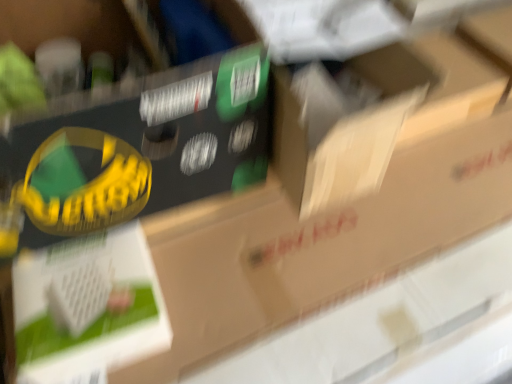
Where is `cardboard box at center`? cardboard box at center is located at coordinates (343, 124).

What is the approximate width of cardboard box at center?

8.60 inches.

What do you see at coordinates (343, 124) in the screenshot?
I see `cardboard box at center` at bounding box center [343, 124].

The width and height of the screenshot is (512, 384). What do you see at coordinates (136, 147) in the screenshot? I see `cardboard box at center` at bounding box center [136, 147].

Consider the image. In order to face cardboard box at center, should I rotate leftwards or rightwards?

A 11.428 degree turn to the left will do.

In order to click on cardboard box at center in this screenshot , I will do `click(136, 147)`.

Where is `cardboard box at center`? Image resolution: width=512 pixels, height=384 pixels. cardboard box at center is located at coordinates (343, 124).

Which object is positioned more to the right, cardboard box at center or cardboard box at center?

cardboard box at center is more to the right.

Considering their positions, is cardboard box at center located in front of or behind cardboard box at center?

Visually, cardboard box at center is located in front of cardboard box at center.

Which point is more forward, (228, 109) or (343, 187)?

The point (228, 109) is closer to the camera.

From the image's perspective, does cardboard box at center appear higher than cardboard box at center?

Indeed, from the image's perspective, cardboard box at center is shown above cardboard box at center.

From a real-world perspective, which object rests below the other?

From a 3D spatial view, cardboard box at center is below.

Looking at their sizes, would you say cardboard box at center is wider or thinner than cardboard box at center?

Clearly, cardboard box at center has more width compared to cardboard box at center.

Who is taller, cardboard box at center or cardboard box at center?

cardboard box at center is taller.

Which of these two, cardboard box at center or cardboard box at center, is bigger?

cardboard box at center.

Is cardboard box at center surrounded by cardboard box at center?

No, cardboard box at center does not contain cardboard box at center.

Is cardboard box at center positioned far away from cardboard box at center?

That's not correct — cardboard box at center is a little close to cardboard box at center.

Could you tell me if cardboard box at center is turned towards cardboard box at center?

Yes, cardboard box at center is aimed at cardboard box at center.

How many degrees apart are the facing directions of cardboard box at center and cardboard box at center?

cardboard box at center and cardboard box at center are facing 0.374 degrees away from each other.

Find the location of `cardboard box that appears behind the cardboard box at center`. cardboard box that appears behind the cardboard box at center is located at coordinates (343, 124).

Which object is positioned more to the left, cardboard box at center or cardboard box at center?

From the viewer's perspective, cardboard box at center appears more on the left side.

In the image, is cardboard box at center positioned in front of or behind cardboard box at center?

cardboard box at center is behind cardboard box at center.

Between point (314, 167) and point (148, 106), which one is positioned behind?

The point (314, 167) is more distant.

From the image's perspective, is cardboard box at center positioned above or below cardboard box at center?

cardboard box at center is situated lower than cardboard box at center in the image.

From a real-world perspective, does cardboard box at center sit lower than cardboard box at center?

No.

Is cardboard box at center wider than cardboard box at center?

Incorrect, the width of cardboard box at center does not surpass that of cardboard box at center.

Based on the photo, considering the sizes of objects cardboard box at center and cardboard box at center in the image provided, who is shorter, cardboard box at center or cardboard box at center?

cardboard box at center is shorter.

From the picture: Considering the relative sizes of cardboard box at center and cardboard box at center in the image provided, is cardboard box at center bigger than cardboard box at center?

Incorrect, cardboard box at center is not larger than cardboard box at center.

Would you say cardboard box at center is inside or outside cardboard box at center?

cardboard box at center fits inside cardboard box at center.

Is cardboard box at center with cardboard box at center?

There is a gap between cardboard box at center and cardboard box at center.

Is cardboard box at center turned away from cardboard box at center?

That's right, cardboard box at center is facing away from cardboard box at center.

How distant is cardboard box at center from cardboard box at center?

cardboard box at center is 5.93 inches from cardboard box at center.

Where is `storage box above the cardboard box at center (from the image's perspective)`? The image size is (512, 384). storage box above the cardboard box at center (from the image's perspective) is located at coordinates (136, 147).

Image resolution: width=512 pixels, height=384 pixels. Identify the location of cardboard box lying behind the cardboard box at center. (343, 124).

I want to click on cardboard box below the cardboard box at center (from the image's perspective), so click(x=343, y=124).